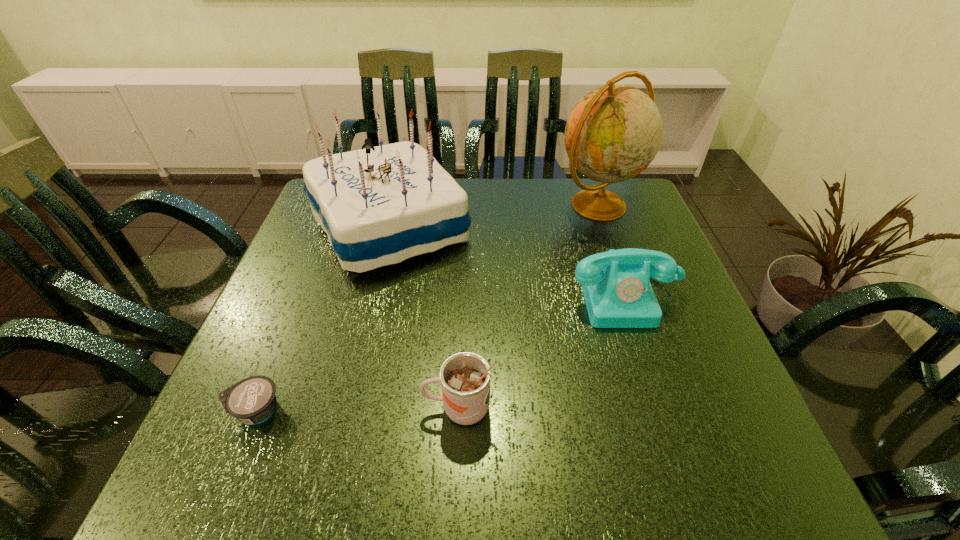
At what (x,y) coordinates should I click in order to perform the action: click on vacant space in between the birthday cake and the yogurt. Please return your answer as a coordinate pair (x, y). Looking at the image, I should click on (323, 319).

Image resolution: width=960 pixels, height=540 pixels. In order to click on vacant space that's between the shortest object and the tallest object in this screenshot , I will do `click(427, 308)`.

Find the location of `vacant area that lies between the telephone and the cup`. vacant area that lies between the telephone and the cup is located at coordinates (542, 353).

Locate an element on the screen. free space between the cup and the yogurt is located at coordinates (357, 409).

Find the location of `free space between the yogurt and the cup`. free space between the yogurt and the cup is located at coordinates (357, 409).

The image size is (960, 540). What are the coordinates of `vacant space in between the cup and the second tallest object` in the screenshot? It's located at (424, 318).

Select which object is the closest to the cup. Please provide its 2D coordinates. Your answer should be formatted as a tuple, i.e. [(x, y)], where the tuple contains the x and y coordinates of a point satisfying the conditions above.

[(616, 286)]

You are a GUI agent. You are given a task and a screenshot of the screen. Output one action in this format:
    pyautogui.click(x=<x>, y=<y>)
    Task: Click on the object that is the fourth closest to the tallest object
    The width and height of the screenshot is (960, 540).
    Given the screenshot: What is the action you would take?
    pyautogui.click(x=252, y=400)

At what (x,y) coordinates should I click in order to perform the action: click on free space in the image that satisfies the following two spatial constraints: 1. on the back side of the birthday cake; 2. on the left side of the tallest object. Please return your answer as a coordinate pair (x, y). Image resolution: width=960 pixels, height=540 pixels. Looking at the image, I should click on (396, 206).